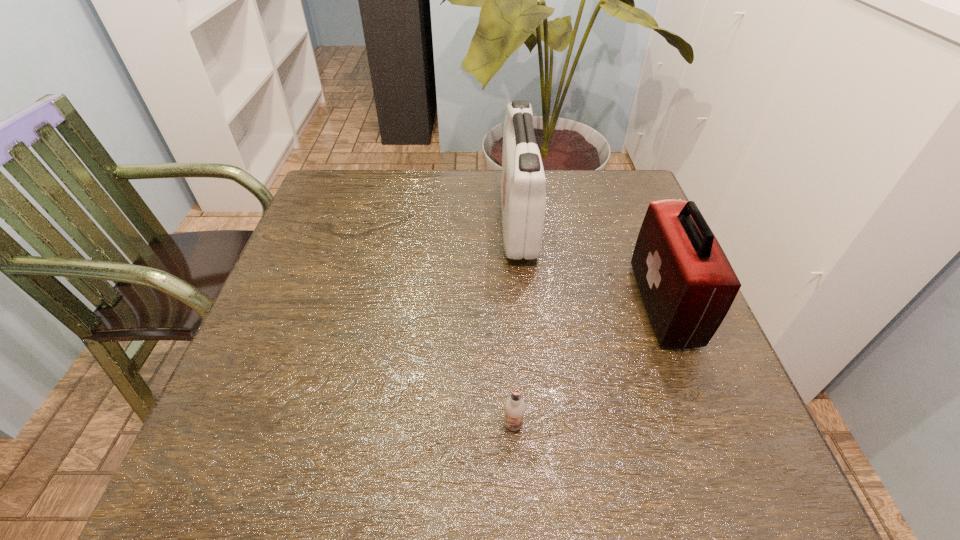
Locate an element on the screen. This screenshot has height=540, width=960. free region located 0.280m on the left of the shortest object is located at coordinates (339, 424).

Where is `object located at the far edge`? Image resolution: width=960 pixels, height=540 pixels. object located at the far edge is located at coordinates (523, 194).

Image resolution: width=960 pixels, height=540 pixels. Identify the location of object situated at the right edge. (687, 284).

The image size is (960, 540). I want to click on free region at the far edge, so click(x=443, y=178).

The image size is (960, 540). In the image, there is a desktop. What are the coordinates of `blank space at the left edge` in the screenshot? It's located at (319, 250).

You are a GUI agent. You are given a task and a screenshot of the screen. Output one action in this format:
    pyautogui.click(x=<x>, y=<y>)
    Task: Click on the vacant space at the far left corner
    The width and height of the screenshot is (960, 540).
    Given the screenshot: What is the action you would take?
    pyautogui.click(x=324, y=218)

Identify the location of vacant space at the near left corner of the desktop. (277, 457).

Identify the location of vacant space at the far right corner. (647, 203).

Where is `vacant space at the near right corner`? The width and height of the screenshot is (960, 540). vacant space at the near right corner is located at coordinates (684, 453).

I want to click on free space between the shortest object and the rightmost object, so click(x=588, y=364).